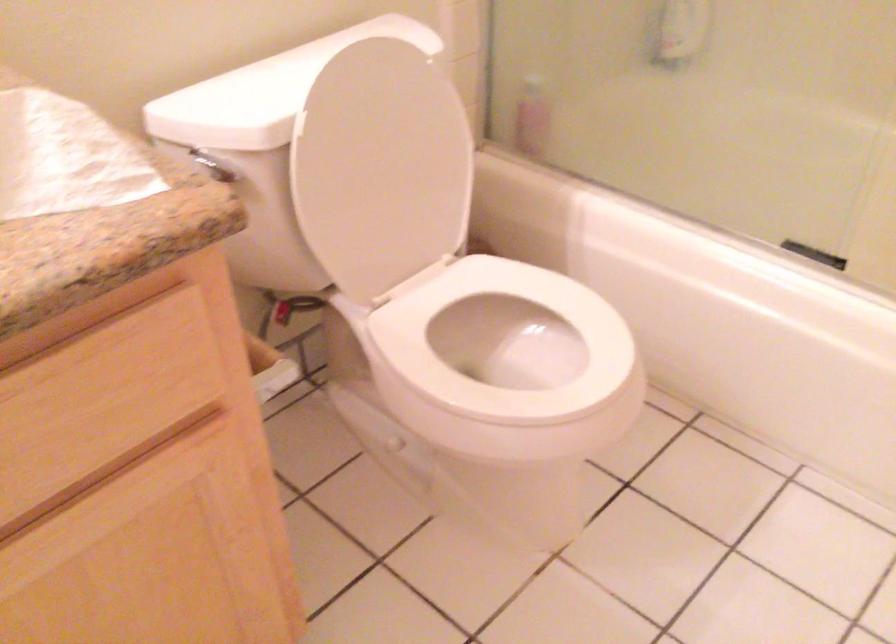
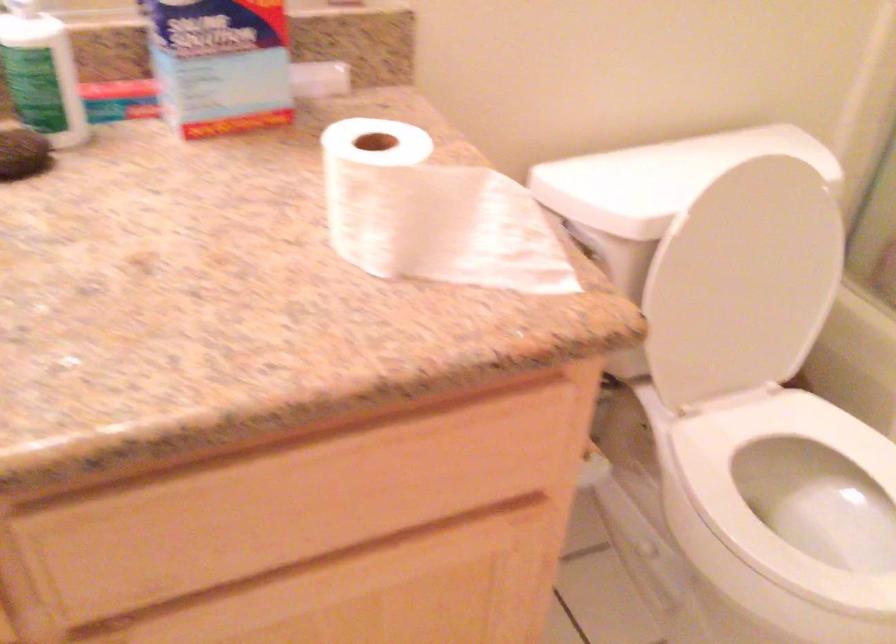
Question: What movement of the cameraman would produce the second image?

Choices:
 (A) Left
 (B) Right
 (C) Forward
 (D) Backward

Answer: (A)